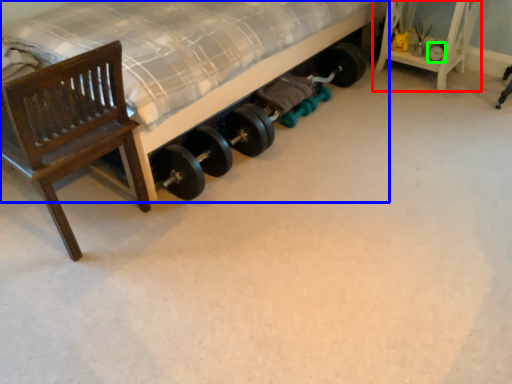
Question: Estimate the real-world distances between objects in this image. Which object is farther from furniture (highlighted by a red box), bed (highlighted by a blue box) or tire (highlighted by a green box)?

Choices:
 (A) bed
 (B) tire

Answer: (A)